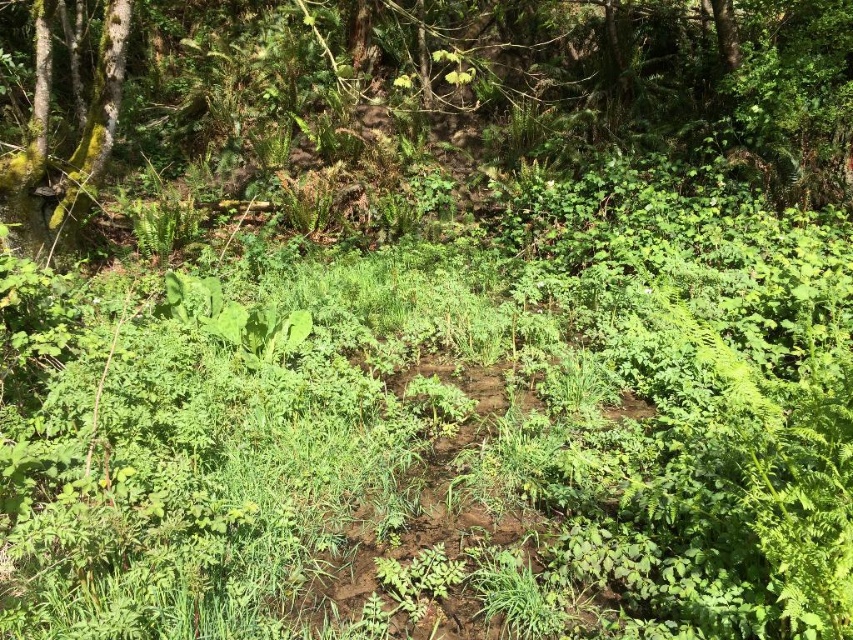
You are a photographer standing in the forest scene. You want to take a photo that includes both the point at coordinates point (695,38) and point (12,218). Based on their positions, which point is closer to your camera lens?

Point (12,218) is closer to the camera lens because the description states that point (695,38) is further to the camera than point (12,218).

You are a hiker who wants to take a photo of the green leafy tree at upper center and the green mossy tree at upper left. Which tree should you stand closer to in order to capture both trees in the same frame?

To capture both the green leafy tree at upper center and the green mossy tree at upper left in the same frame, you should stand closer to the green mossy tree at upper left since the green leafy tree at upper center is bigger and might dominate the view if you stand closer to it.

You are a hiker who wants to take a photo of the green leafy tree at upper center and the green mossy tree at upper left. Which tree should you position yourself to the left of to capture both in the frame?

You should position yourself to the left of the green mossy tree at upper left because the green leafy tree at upper center is to the right of it, so both trees will be in the frame when you stand there.